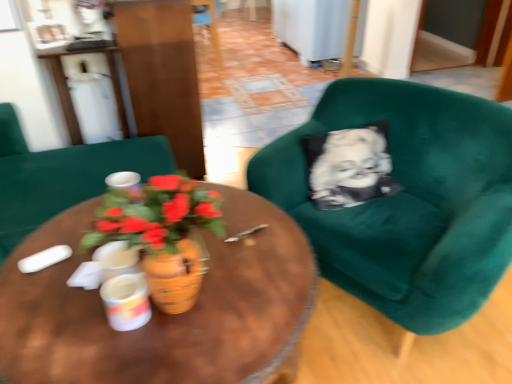
Question: From the image's perspective, is terracotta pot at center located above white glossy coffee cup at center, the second coffee cup positioned from the back?

Choices:
 (A) no
 (B) yes

Answer: (B)

Question: From a real-world perspective, is terracotta pot at center beneath white glossy coffee cup at center, which is the first coffee cup in bottom-to-top order?

Choices:
 (A) yes
 (B) no

Answer: (B)

Question: Is the surface of terracotta pot at center in direct contact with white glossy coffee cup at center, the second coffee cup positioned from the back?

Choices:
 (A) yes
 (B) no

Answer: (B)

Question: Is terracotta pot at center not within white glossy coffee cup at center, which is the first coffee cup in bottom-to-top order?

Choices:
 (A) yes
 (B) no

Answer: (A)

Question: Is terracotta pot at center shorter than white glossy coffee cup at center, placed as the first coffee cup when sorted from front to back?

Choices:
 (A) no
 (B) yes

Answer: (A)

Question: Relative to matte green armchair at center, the second chair viewed from the back, is white glossy coffee cup at center, the second coffee cup positioned from the back, in front or behind?

Choices:
 (A) behind
 (B) front

Answer: (B)

Question: From a real-world perspective, relative to matte green armchair at center, acting as the 2th chair starting from the top, is white glossy coffee cup at center, placed as the first coffee cup when sorted from front to back, vertically above or below?

Choices:
 (A) above
 (B) below

Answer: (A)

Question: In terms of height, does white glossy coffee cup at center, placed as the first coffee cup when sorted from front to back, look taller or shorter compared to matte green armchair at center, acting as the 2th chair starting from the top?

Choices:
 (A) tall
 (B) short

Answer: (B)

Question: From the image's perspective, is white glossy coffee cup at center, placed as the 1th coffee cup when sorted from right to left, above or below matte green armchair at center, which is the 2th chair from front to back?

Choices:
 (A) above
 (B) below

Answer: (B)

Question: Is white glossy coffee cup at center, marked as the 2th coffee cup in a top-to-bottom arrangement, to the left or to the right of velvet green armchair at right, which is the 1th chair from front to back, in the image?

Choices:
 (A) left
 (B) right

Answer: (A)

Question: Relative to velvet green armchair at right, the third chair viewed from the top, is white glossy coffee cup at center, marked as the 2th coffee cup in a top-to-bottom arrangement, in front or behind?

Choices:
 (A) behind
 (B) front

Answer: (B)

Question: Considering the positions of white glossy coffee cup at center, the second coffee cup positioned from the back, and velvet green armchair at right, arranged as the 3th chair when viewed from the left, in the image, is white glossy coffee cup at center, the second coffee cup positioned from the back, taller or shorter than velvet green armchair at right, arranged as the 3th chair when viewed from the left,?

Choices:
 (A) tall
 (B) short

Answer: (B)

Question: From a real-world perspective, relative to velvet green armchair at right, the 1th chair when ordered from right to left, is white glossy coffee cup at center, the second coffee cup positioned from the back, vertically above or below?

Choices:
 (A) above
 (B) below

Answer: (A)

Question: From a real-world perspective, is velvet green armchair at right, the 3th chair in the back-to-front sequence, positioned above or below woodenobject at center?

Choices:
 (A) below
 (B) above

Answer: (B)

Question: Is velvet green armchair at right, which is the 1th chair from bottom to top, in front of or behind woodenobject at center in the image?

Choices:
 (A) behind
 (B) front

Answer: (A)